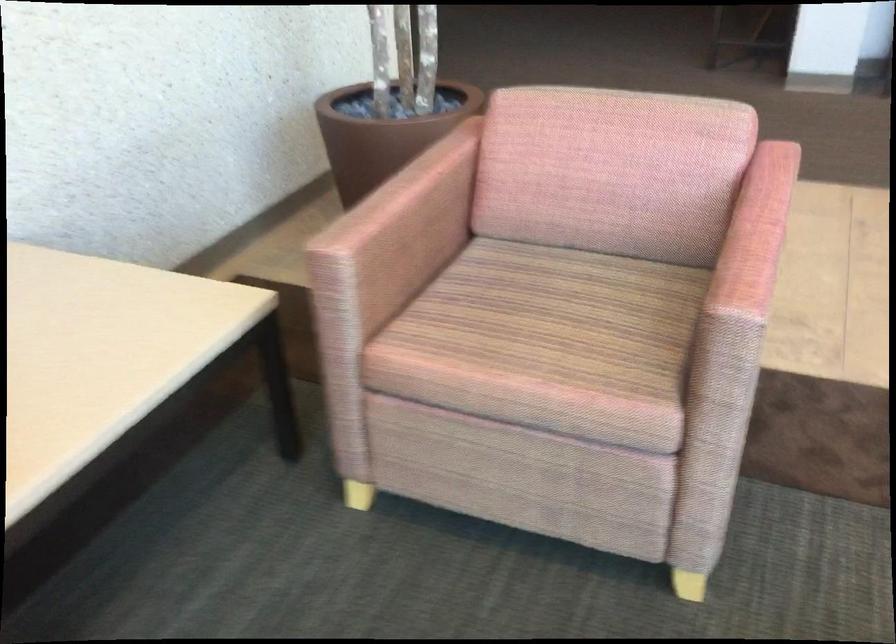
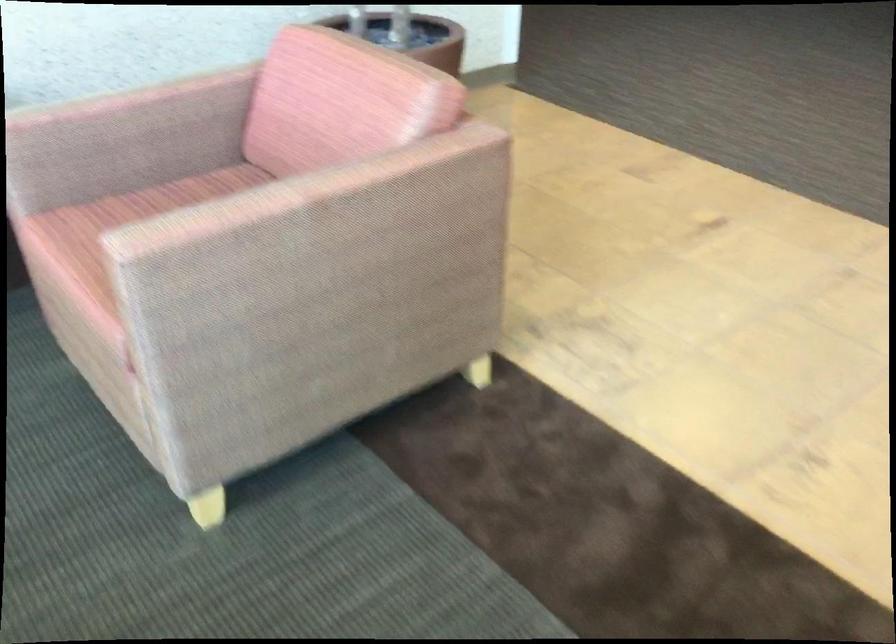
In the second image, find the point that corresponds to [767,223] in the first image.

(298, 192)